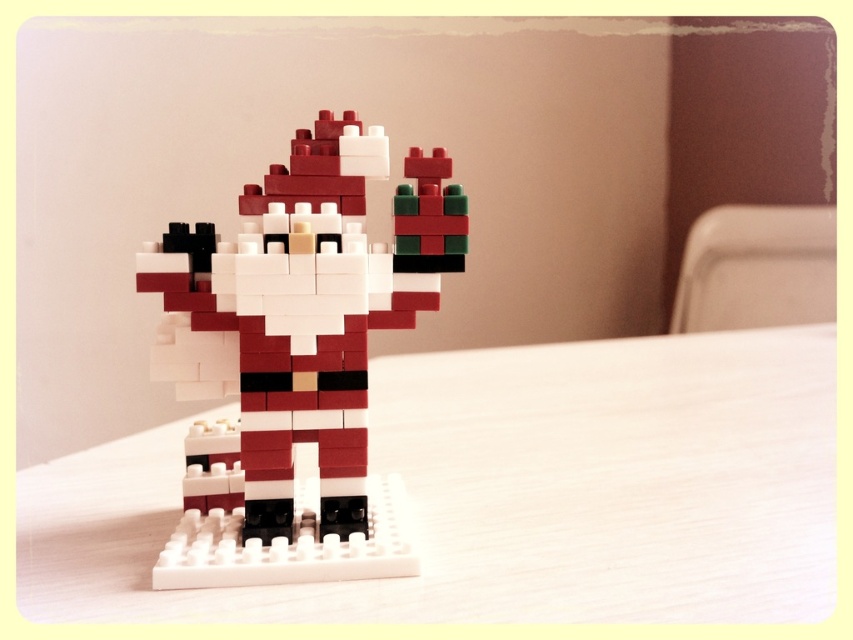
Question: Does white matte table at center have a greater width compared to matte plastic santa at center?

Choices:
 (A) yes
 (B) no

Answer: (A)

Question: Which point appears farthest from the camera in this image?

Choices:
 (A) (277, 428)
 (B) (479, 616)

Answer: (A)

Question: Can you confirm if white matte table at center is positioned above matte plastic santa at center?

Choices:
 (A) yes
 (B) no

Answer: (B)

Question: Is white matte table at center smaller than matte plastic santa at center?

Choices:
 (A) no
 (B) yes

Answer: (A)